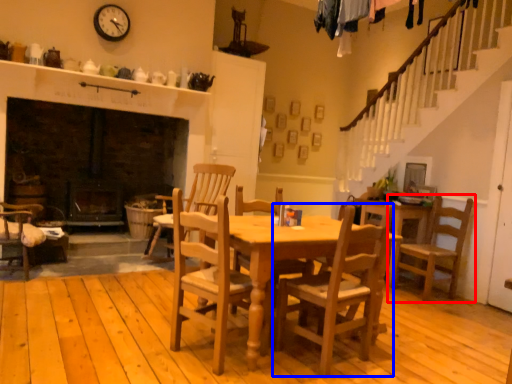
Question: Among these objects, which one is nearest to the camera, chair (highlighted by a red box) or chair (highlighted by a blue box)?

Choices:
 (A) chair
 (B) chair

Answer: (B)